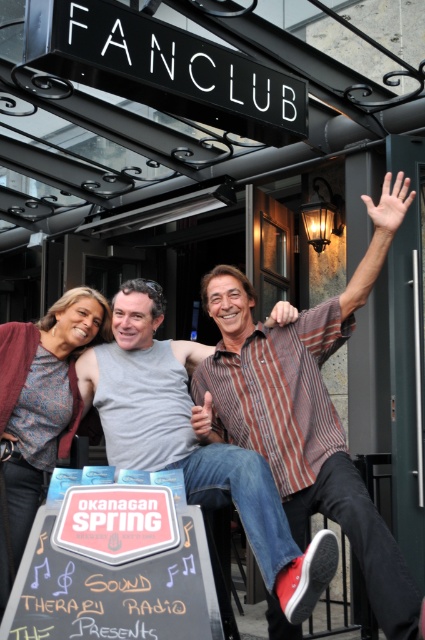
Question: Is striped cotton shirt at upper right bigger than matte gray sweater at center?

Choices:
 (A) no
 (B) yes

Answer: (B)

Question: Is striped cotton shirt at upper right bigger than striped cotton shirt at center?

Choices:
 (A) yes
 (B) no

Answer: (A)

Question: Among these points, which one is farthest from the camera?

Choices:
 (A) (8, 554)
 (B) (248, 516)
 (C) (376, 515)

Answer: (A)

Question: Does striped cotton shirt at center appear on the left side of matte gray sweater at center?

Choices:
 (A) no
 (B) yes

Answer: (A)

Question: Based on their relative distances, which object is nearer to the striped cotton shirt at center?

Choices:
 (A) striped cotton shirt at upper right
 (B) matte gray sweater at center

Answer: (A)

Question: Which point is closer to the camera?

Choices:
 (A) matte gray sweater at center
 (B) striped cotton shirt at center
 (C) striped cotton shirt at upper right

Answer: (C)